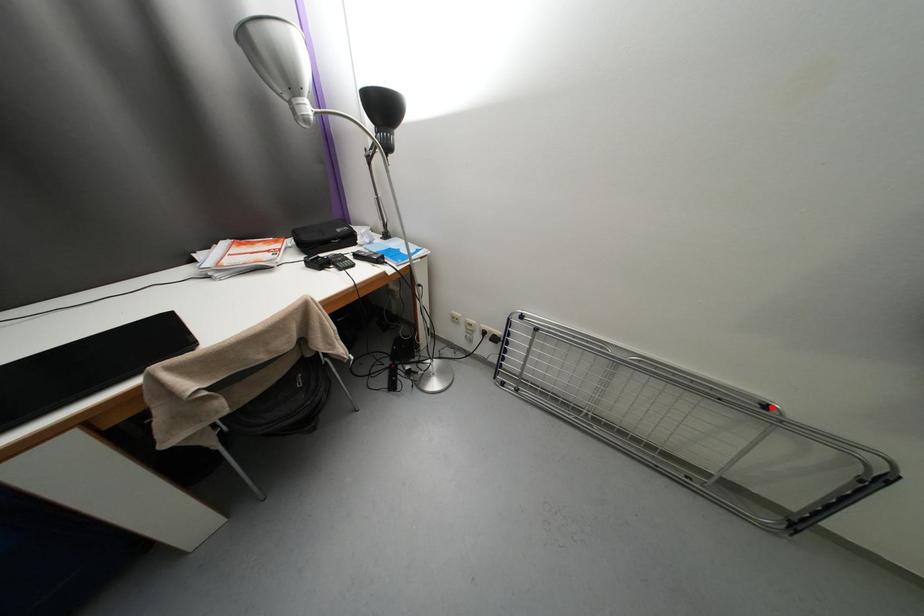
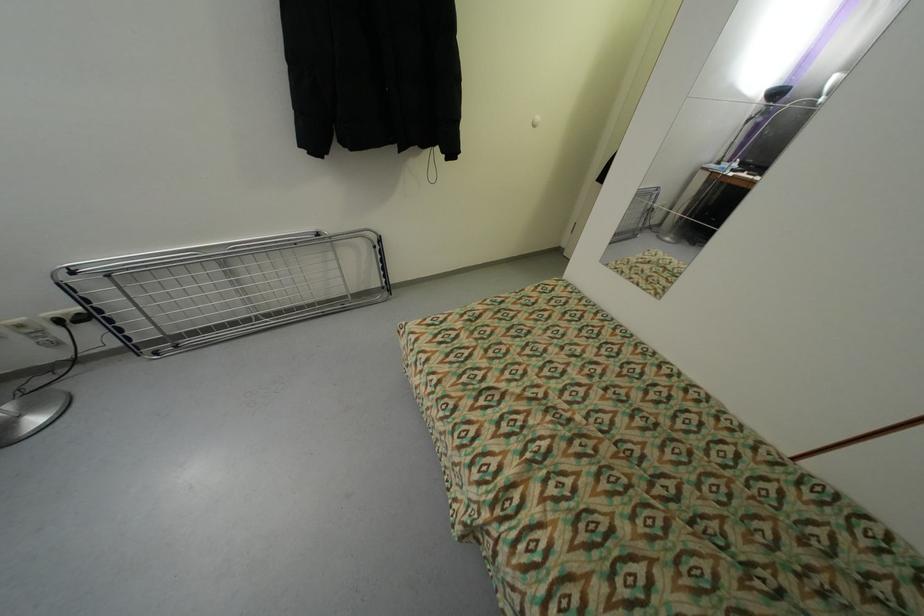
Question: I am providing you with two images of the same scene from different viewpoints. Given a red point in image1, look at the same physical point in image2. Is it:

Choices:
 (A) Closer to the viewpoint
 (B) Farther from the viewpoint

Answer: (A)